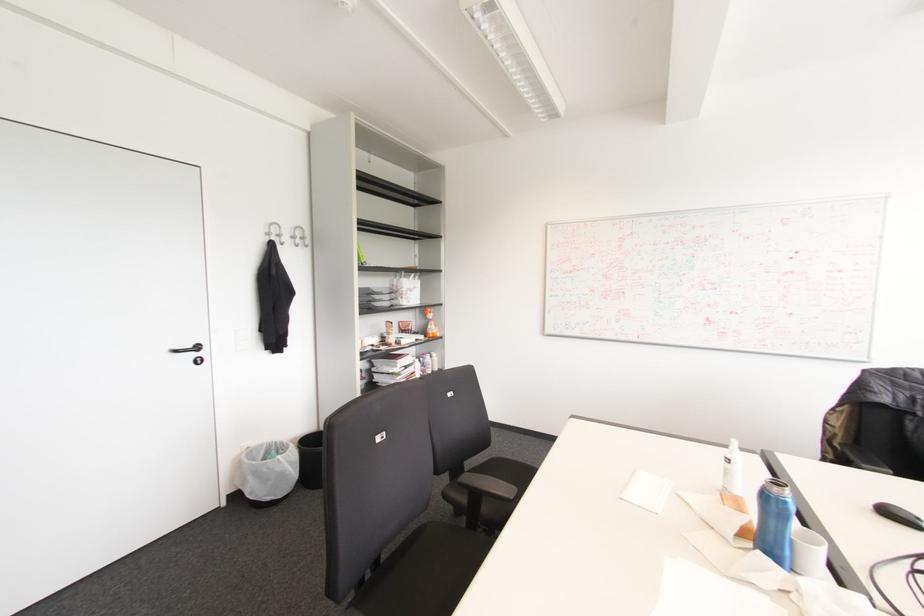
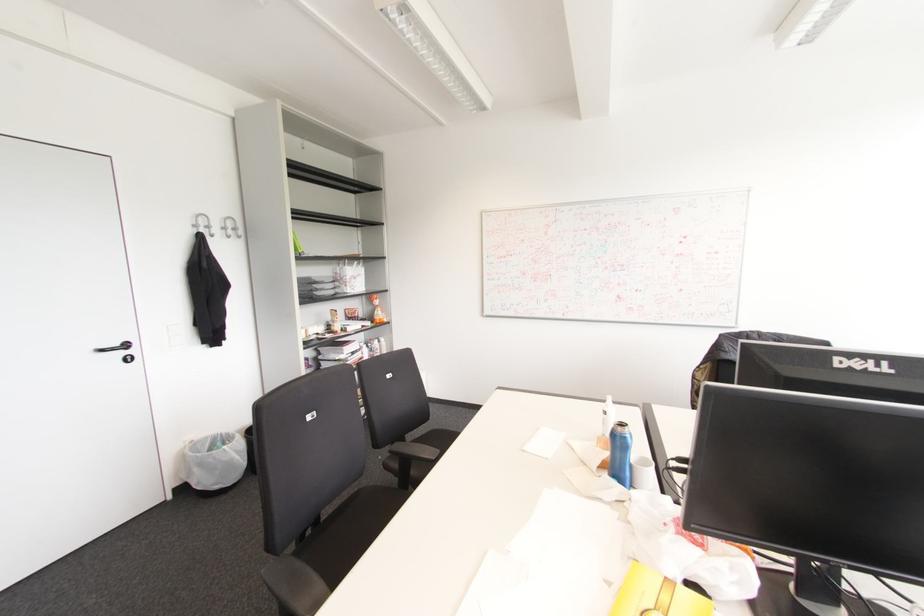
The point at [266,233] is marked in the first image. Where is the corresponding point in the second image?

(195, 225)